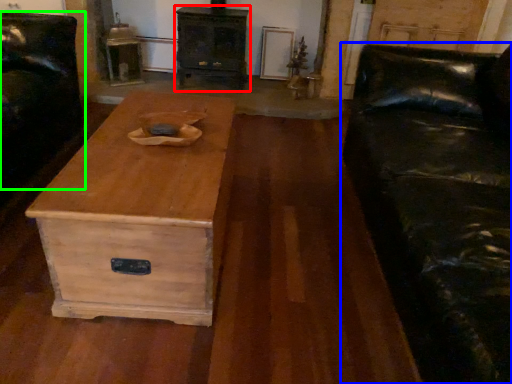
Question: Considering the real-world distances, which object is farthest from chest of drawers (highlighted by a red box)? studio couch (highlighted by a blue box) or armchair (highlighted by a green box)?

Choices:
 (A) studio couch
 (B) armchair

Answer: (A)